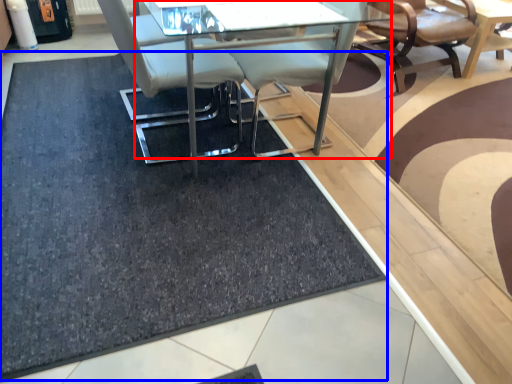
Question: Which object is closer to the camera taking this photo, table (highlighted by a red box) or doormat (highlighted by a blue box)?

Choices:
 (A) table
 (B) doormat

Answer: (B)